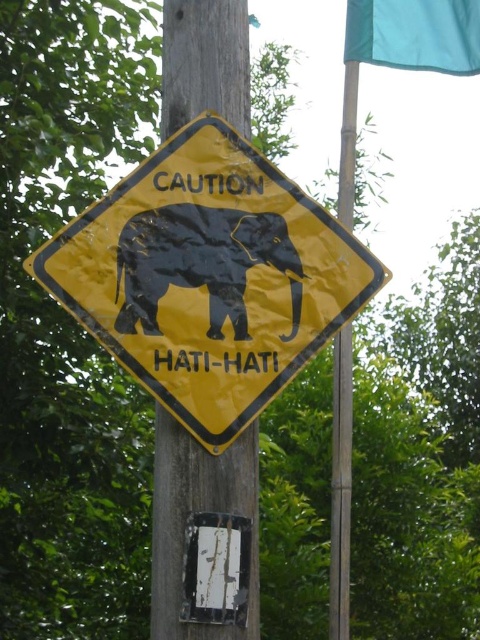
You are a hiker approaching the yellow matte sign at center and the black rubber elephant at center. Which object will you encounter first?

The yellow matte sign at center is closer to the viewer than the black rubber elephant at center, so you will encounter the yellow matte sign at center first.

You are a hiker passing by the yellow caution sign. You notice the black rubber elephant at center and the teal fabric flag at upper right. Which object is located to the left of the other?

The black rubber elephant at center is positioned on the left side of teal fabric flag at upper right.

You are a hiker who wants to take a photo of the teal fabric flag at upper right. To get a clear shot, you need to position yourself so that the wooden telegraph pole at center doesn not block the view. Where should you move relative to the pole?

Move to the side of the wooden telegraph pole at center so that the teal fabric flag at upper right is visible without obstruction. Since the wooden telegraph pole at center is in front of the flag, moving to the left or right side of the pole will allow you to see the flag clearly.